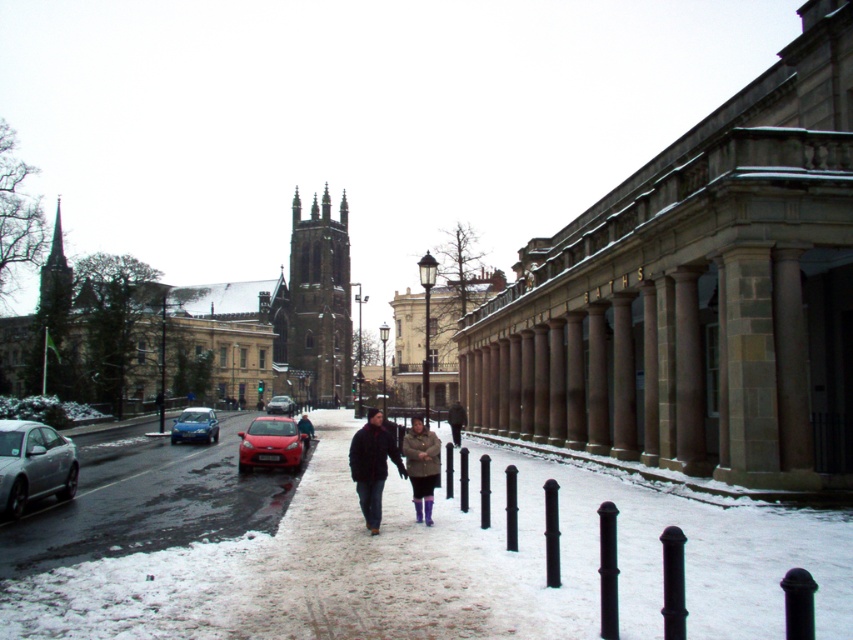
Question: Does white stone church at center have a larger size compared to metallic blue sedan at center-left?

Choices:
 (A) no
 (B) yes

Answer: (B)

Question: Is white stone church at center smaller than matte brown coat at center?

Choices:
 (A) no
 (B) yes

Answer: (A)

Question: Which point is closer to the camera taking this photo?

Choices:
 (A) (524, 349)
 (B) (294, 467)

Answer: (B)

Question: Which object is the farthest from the white snow at center?

Choices:
 (A) metallic blue sedan at center-left
 (B) matte red car at center

Answer: (B)

Question: Which object appears closest to the camera in this image?

Choices:
 (A) brown stone church at center
 (B) metallic blue sedan at center-left
 (C) brown stone columns at center
 (D) shiny red car at center

Answer: (C)

Question: In this image, where is silver metallic sedan at left located relative to shiny red car at center?

Choices:
 (A) right
 (B) left

Answer: (A)